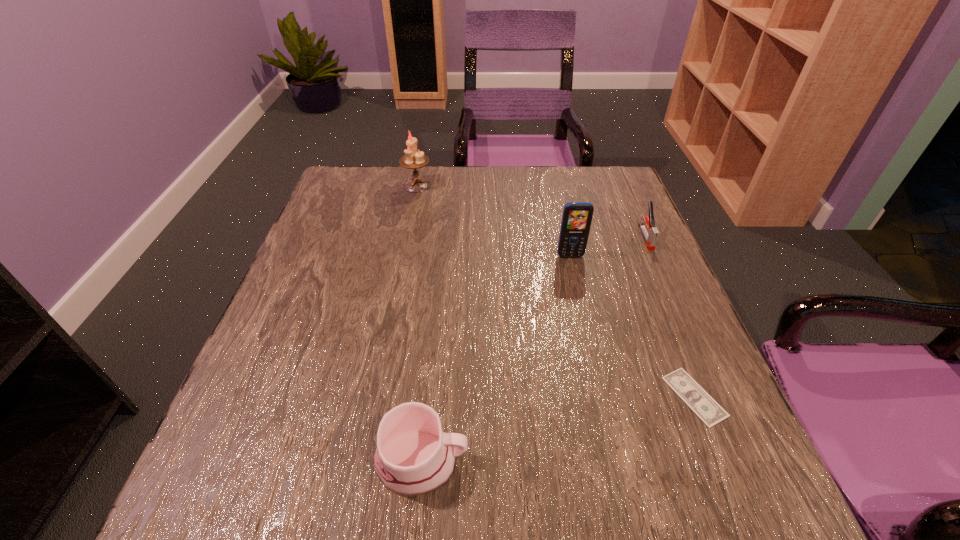
This screenshot has width=960, height=540. Identify the location of vacant area between the nearest object and the shortest object. (558, 429).

Point out which object is positioned as the second nearest to the mug. Please provide its 2D coordinates. Your answer should be formatted as a tuple, i.e. [(x, y)], where the tuple contains the x and y coordinates of a point satisfying the conditions above.

[(576, 221)]

Select which object is the fourth closest to the shortest object. Please provide its 2D coordinates. Your answer should be formatted as a tuple, i.e. [(x, y)], where the tuple contains the x and y coordinates of a point satisfying the conditions above.

[(413, 159)]

You are a GUI agent. You are given a task and a screenshot of the screen. Output one action in this format:
    pyautogui.click(x=<x>, y=<y>)
    Task: Click on the free spot that satisfies the following two spatial constraints: 1. on the front side of the money; 2. on the right side of the candle holder
    
    Given the screenshot: What is the action you would take?
    pyautogui.click(x=375, y=396)

This screenshot has width=960, height=540. Find the location of `free space that satisfies the following two spatial constraints: 1. on the screen of the cellular telephone; 2. on the side with the handle of the nearest object`. free space that satisfies the following two spatial constraints: 1. on the screen of the cellular telephone; 2. on the side with the handle of the nearest object is located at coordinates (617, 462).

You are a GUI agent. You are given a task and a screenshot of the screen. Output one action in this format:
    pyautogui.click(x=<x>, y=<y>)
    Task: Click on the vacant region that satisfies the following two spatial constraints: 1. on the handle side of the second farthest object; 2. on the side with the handle of the mug
    
    Given the screenshot: What is the action you would take?
    tap(746, 462)